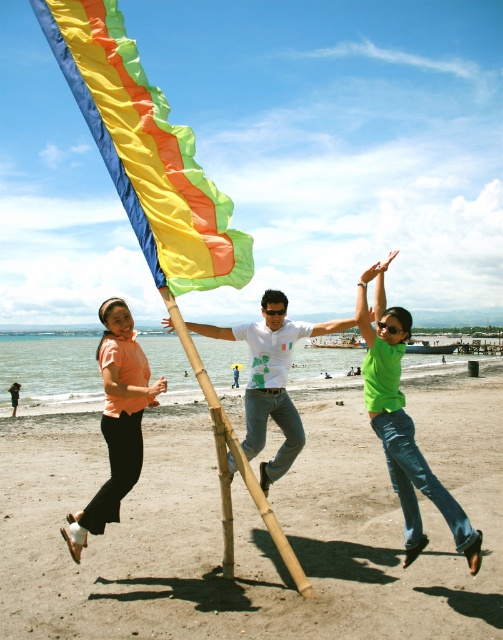
Who is shorter, multicolored fabric flag at center or matte peach blouse at left?

With less height is multicolored fabric flag at center.

Can you confirm if multicolored fabric flag at center is positioned to the left of matte peach blouse at left?

Yes, multicolored fabric flag at center is to the left of matte peach blouse at left.

Measure the distance between multicolored fabric flag at center and camera.

multicolored fabric flag at center is 5.95 meters away from camera.

I want to click on multicolored fabric flag at center, so click(145, 150).

Is sandy beach at lower center further to camera compared to white printed t-shirt at center?

No, sandy beach at lower center is closer to the viewer.

Who is taller, sandy beach at lower center or white printed t-shirt at center?

white printed t-shirt at center

Is point (104, 605) farther from camera compared to point (280, 348)?

No, it is in front of (280, 348).

Find the location of a particular element. sandy beach at lower center is located at coordinates (256, 528).

Does sandy beach at lower center lie in front of green matte shirt at center?

Yes, it is in front of green matte shirt at center.

Between sandy beach at lower center and green matte shirt at center, which one has more height?

Standing taller between the two is green matte shirt at center.

In order to click on sandy beach at lower center in this screenshot , I will do `click(256, 528)`.

Identify the location of sandy beach at lower center. (x=256, y=528).